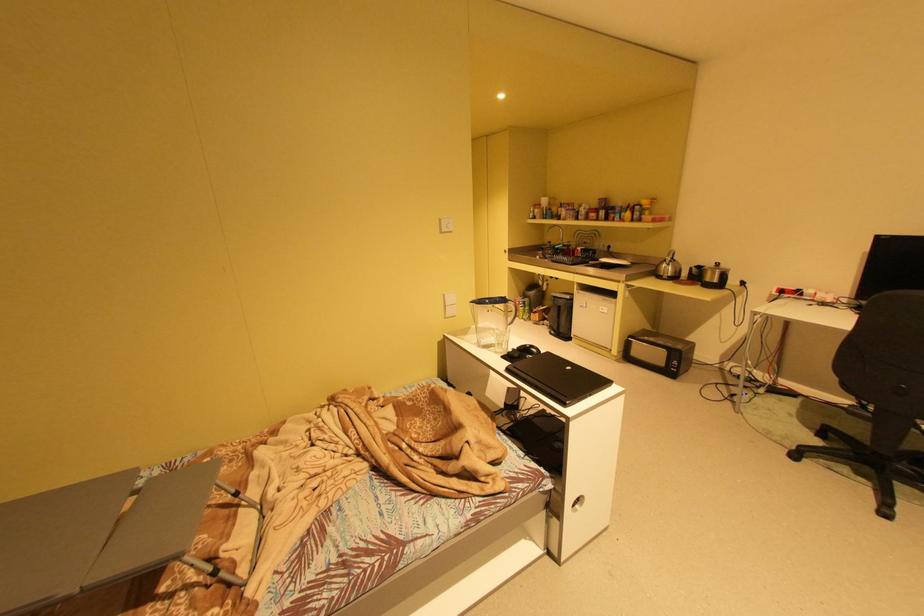
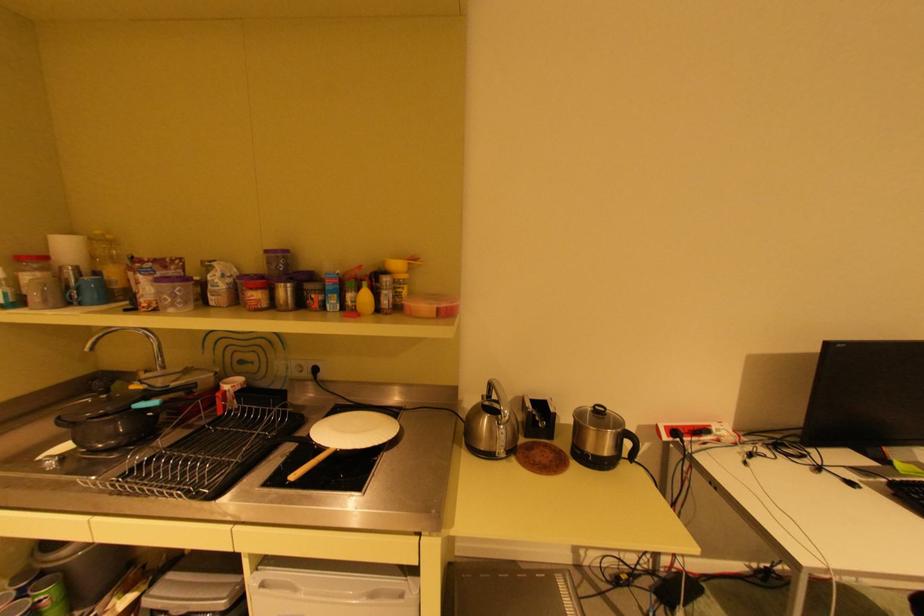
Where in the second image is the point corresponding to point 552,219 from the first image?

(79, 302)